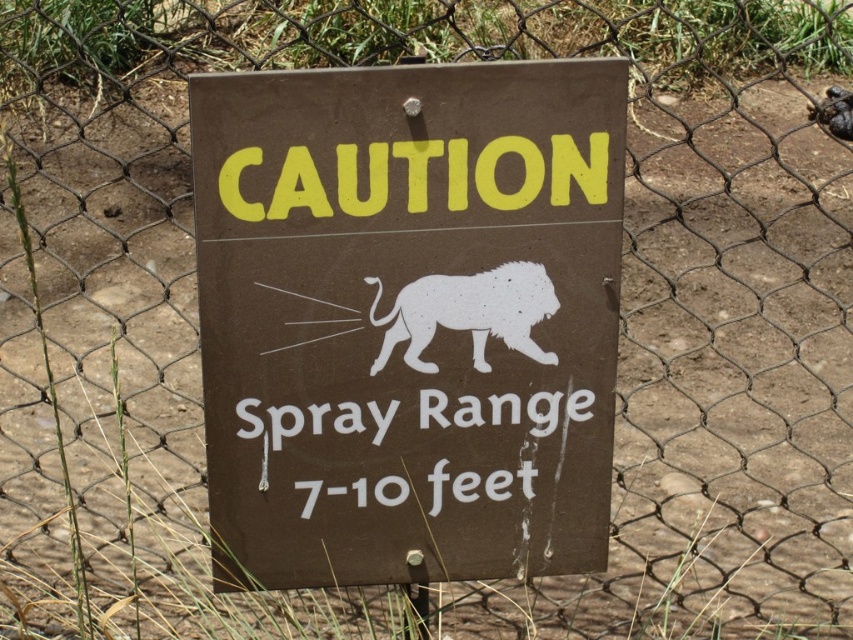
You are a park ranger checking the placement of the brown matte sign at center and the white matte lion at center on the caution sign. According to safety guidelines, these two elements must be at least 5 inches apart to ensure visibility. Is the current spacing compliant with the guidelines?

The brown matte sign at center and white matte lion at center are 4.75 inches apart from each other, which is less than the required 5 inches. Therefore, the current spacing does not comply with the safety guidelines.

You are a park visitor who wants to take a photo of the brown matte sign at center and the white matte lion at center. Since you have a camera with a fixed focal length, you need to know which object is larger to adjust your distance. Which object should you focus on first to ensure it fills the frame appropriately?

The brown matte sign at center is bigger than the white matte lion at center, so you should focus on the brown matte sign at center first to ensure it fills the frame appropriately.

You are a hiker who just spotted the brown matte sign at center and the white matte lion at center on a fence. According to the sign, what is the maximum distance the lion can spray? Please answer with the number and unit of measurement provided on the sign.

The maximum distance the lion can spray is 10 feet, as stated under the white matte lion at center on the sign.